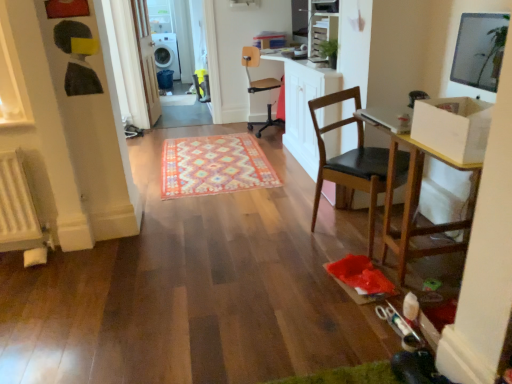
Identify the location of free space to the left of black leather chair at center, which ranks as the 1th chair in bottom-to-top order. Image resolution: width=512 pixels, height=384 pixels. (286, 233).